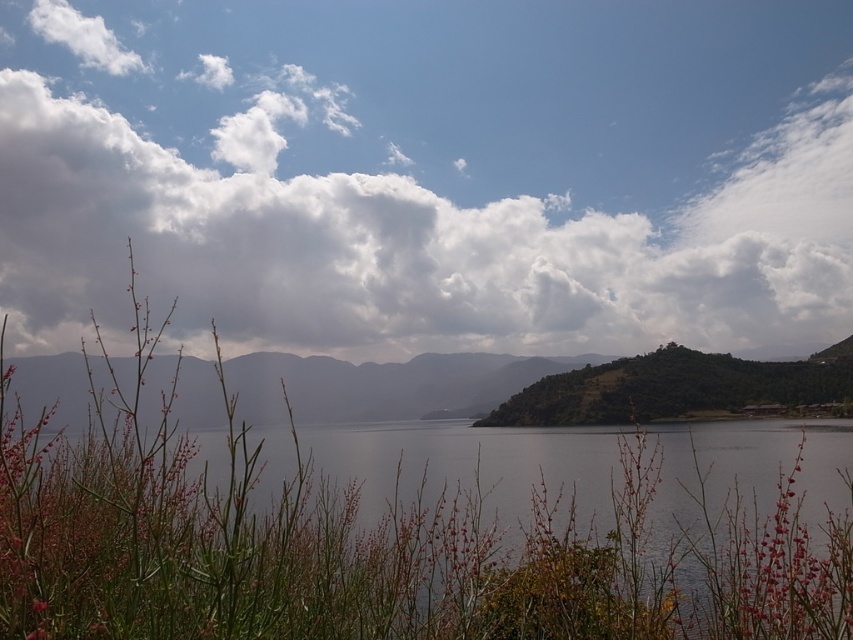
Does white fluffy cloud at upper center have a greater width compared to green textured hillside at center?

Yes.

Is white fluffy cloud at upper center below green textured hillside at center?

Incorrect, white fluffy cloud at upper center is not positioned below green textured hillside at center.

Who is more forward, (x=30, y=113) or (x=456, y=380)?

Point (x=456, y=380) is more forward.

This screenshot has height=640, width=853. I want to click on white fluffy cloud at upper center, so click(x=405, y=244).

Looking at this image, is smooth gray water at center to the left of green textured hillside at center from the viewer's perspective?

Correct, you'll find smooth gray water at center to the left of green textured hillside at center.

Can you confirm if smooth gray water at center is positioned below green textured hillside at center?

Actually, smooth gray water at center is above green textured hillside at center.

Find the location of a particular element. smooth gray water at center is located at coordinates (386, 556).

Can you confirm if white fluffy cloud at upper center is taller than smooth gray water at center?

Correct, white fluffy cloud at upper center is much taller as smooth gray water at center.

This screenshot has height=640, width=853. What are the coordinates of `white fluffy cloud at upper center` in the screenshot? It's located at (405, 244).